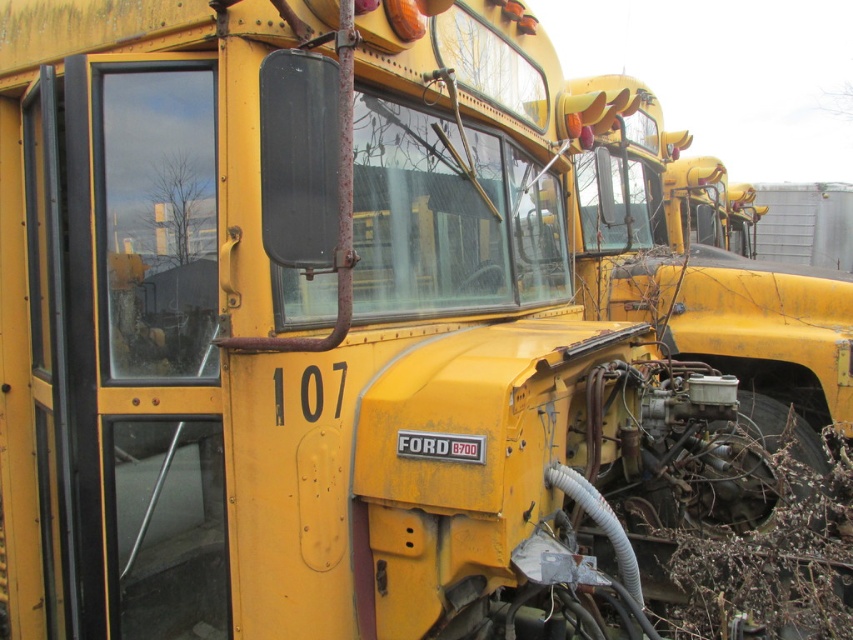
Can you confirm if brown fibrous weed at lower right is smaller than yellow matte license plate at center?

Actually, brown fibrous weed at lower right might be larger than yellow matte license plate at center.

Is brown fibrous weed at lower right to the left of yellow matte license plate at center from the viewer's perspective?

Incorrect, brown fibrous weed at lower right is not on the left side of yellow matte license plate at center.

Where is `brown fibrous weed at lower right`? The height and width of the screenshot is (640, 853). brown fibrous weed at lower right is located at coordinates (770, 557).

At what (x,y) coordinates should I click in order to perform the action: click on brown fibrous weed at lower right. Please return your answer as a coordinate pair (x, y). Image resolution: width=853 pixels, height=640 pixels. Looking at the image, I should click on (770, 557).